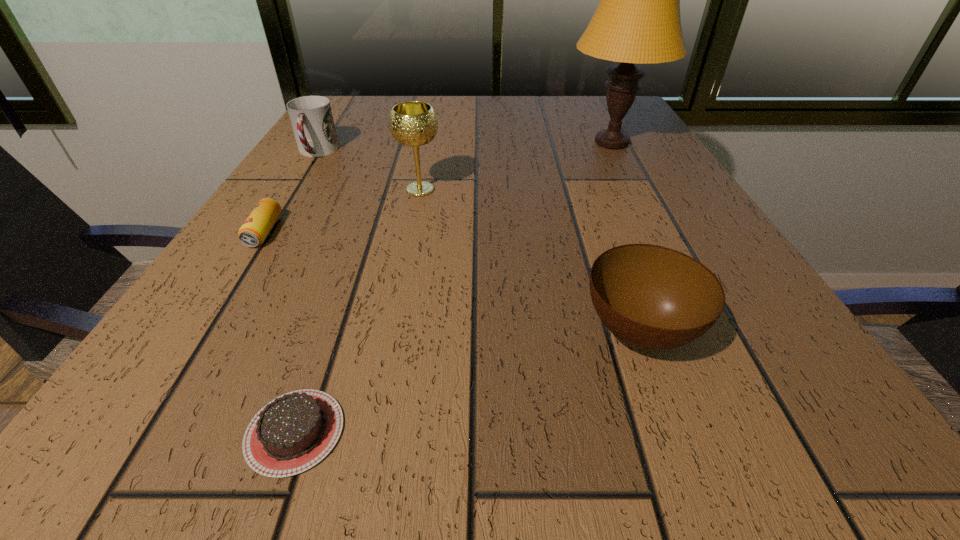
Where is `free spot between the bowl and the tallest object`? free spot between the bowl and the tallest object is located at coordinates point(625,237).

What are the coordinates of `blank region between the bowl and the beer can` in the screenshot? It's located at (452, 281).

What are the coordinates of `object that is the closest to the cup` in the screenshot? It's located at (413, 123).

Select which object is the second closest to the third nearest object. Please provide its 2D coordinates. Your answer should be formatted as a tuple, i.e. [(x, y)], where the tuple contains the x and y coordinates of a point satisfying the conditions above.

[(413, 123)]

This screenshot has height=540, width=960. Identify the location of vacant space that satisfies the following two spatial constraints: 1. on the back side of the nearest object; 2. on the left side of the fifth farthest object. (329, 332).

The width and height of the screenshot is (960, 540). Find the location of `vacant space that satisfies the following two spatial constraints: 1. on the side of the cup where the handle is located; 2. on the left side of the fifth shortest object`. vacant space that satisfies the following two spatial constraints: 1. on the side of the cup where the handle is located; 2. on the left side of the fifth shortest object is located at coordinates (293, 190).